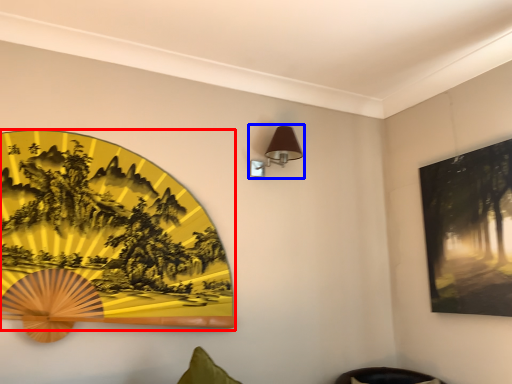
Question: Among these objects, which one is nearest to the camera, picture frame (highlighted by a red box) or table lamp (highlighted by a blue box)?

Choices:
 (A) picture frame
 (B) table lamp

Answer: (A)